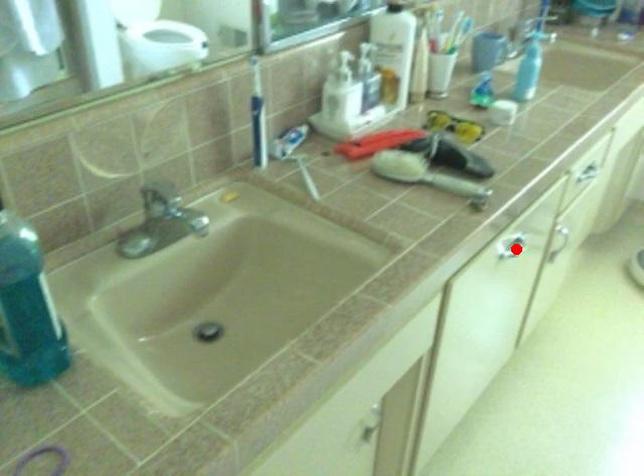
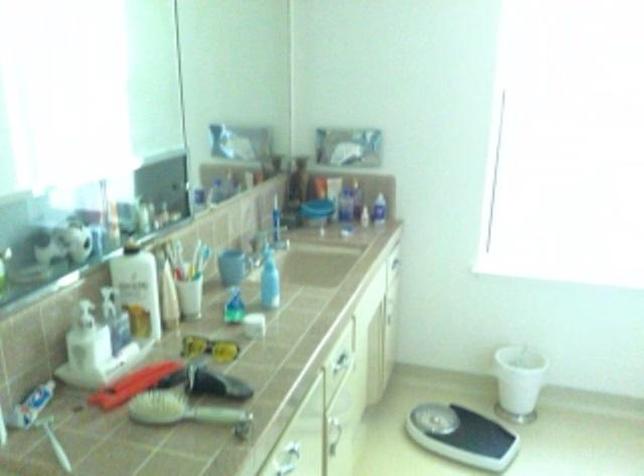
In the second image, find the point that corresponds to the highlighted location in the first image.

(290, 455)